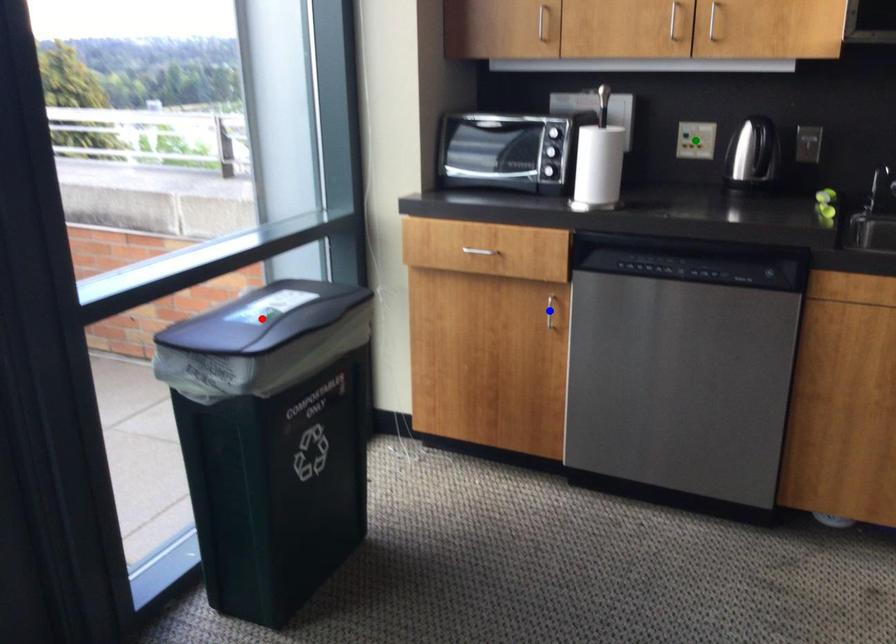
Order these from nearest to farthest:
1. red point
2. blue point
3. green point

red point → blue point → green point